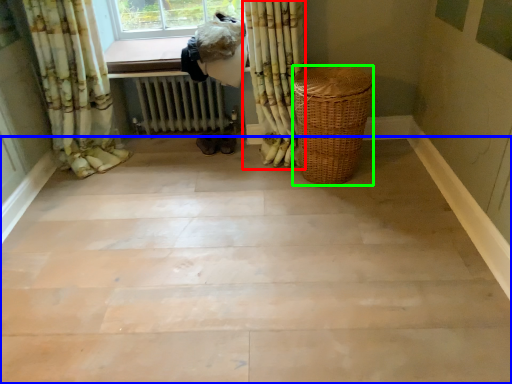
Question: Based on their relative distances, which object is farther from curtain (highlighted by a red box)? Choose from stairwell (highlighted by a blue box) and basket (highlighted by a green box).

Choices:
 (A) stairwell
 (B) basket

Answer: (A)